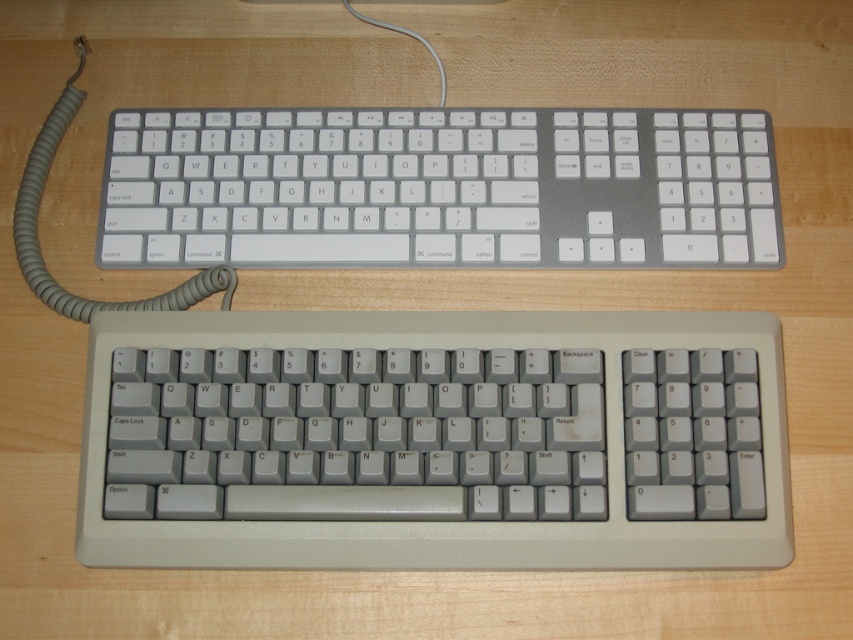
Does gray plastic keyboard at center come in front of white plastic keyboard at center?

Yes, gray plastic keyboard at center is in front of white plastic keyboard at center.

Describe the element at coordinates (434, 440) in the screenshot. I see `gray plastic keyboard at center` at that location.

Does point (648, 516) come in front of point (141, 113)?

Yes.

The height and width of the screenshot is (640, 853). I want to click on gray plastic keyboard at center, so click(x=434, y=440).

Is gray plastic keyboard at center thinner than gray rubberized cord at upper left?

In fact, gray plastic keyboard at center might be wider than gray rubberized cord at upper left.

Does gray plastic keyboard at center appear on the right side of gray rubberized cord at upper left?

Yes, gray plastic keyboard at center is to the right of gray rubberized cord at upper left.

In order to click on gray plastic keyboard at center in this screenshot , I will do coord(434,440).

Describe the element at coordinates (438, 188) in the screenshot. I see `white plastic keyboard at center` at that location.

From the picture: Does white plastic keyboard at center have a smaller size compared to gray rubberized cord at upper left?

Yes.

Image resolution: width=853 pixels, height=640 pixels. Find the location of `white plastic keyboard at center`. white plastic keyboard at center is located at coordinates (438, 188).